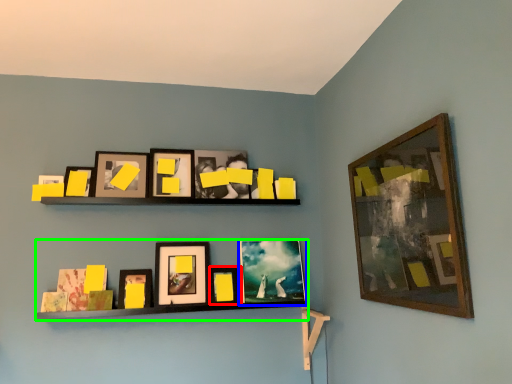
Question: Estimate the real-world distances between objects in this image. Which object is farther from picture frame (highlighted by a red box), picture frame (highlighted by a blue box) or shelf (highlighted by a green box)?

Choices:
 (A) picture frame
 (B) shelf

Answer: (B)